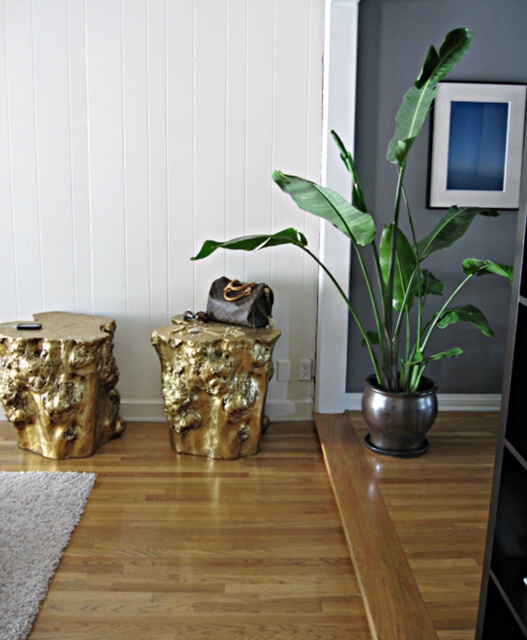
Question: Which point is closer to the camera?

Choices:
 (A) metallic silver picture frame at upper right
 (B) green leafy plant at upper right
 (C) gold textured stump at center

Answer: (B)

Question: Which of the following is the closest to the observer?

Choices:
 (A) gold textured stump at center
 (B) gold textured stump at left
 (C) metallic silver picture frame at upper right
 (D) green leafy plant at upper right

Answer: (D)

Question: Which point is farther from the camera taking this photo?

Choices:
 (A) (27, 374)
 (B) (423, 113)

Answer: (A)

Question: Considering the relative positions of green leafy plant at upper right and gold textured stump at center in the image provided, where is green leafy plant at upper right located with respect to gold textured stump at center?

Choices:
 (A) left
 (B) right

Answer: (B)

Question: Is gold textured stump at left smaller than metallic silver picture frame at upper right?

Choices:
 (A) no
 (B) yes

Answer: (A)

Question: Observing the image, what is the correct spatial positioning of gold textured stump at left in reference to metallic silver picture frame at upper right?

Choices:
 (A) below
 (B) above

Answer: (A)